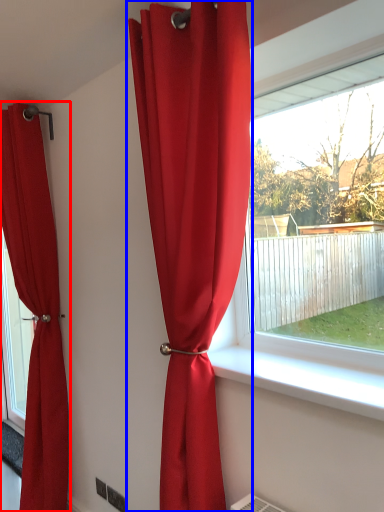
Question: Which point is further to the camera, curtain (highlighted by a red box) or curtain (highlighted by a blue box)?

Choices:
 (A) curtain
 (B) curtain

Answer: (A)